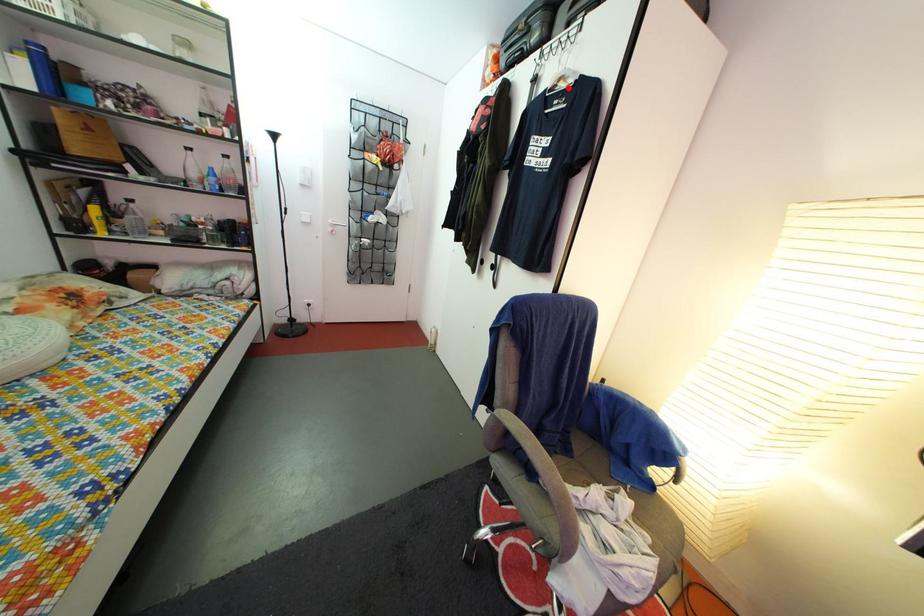
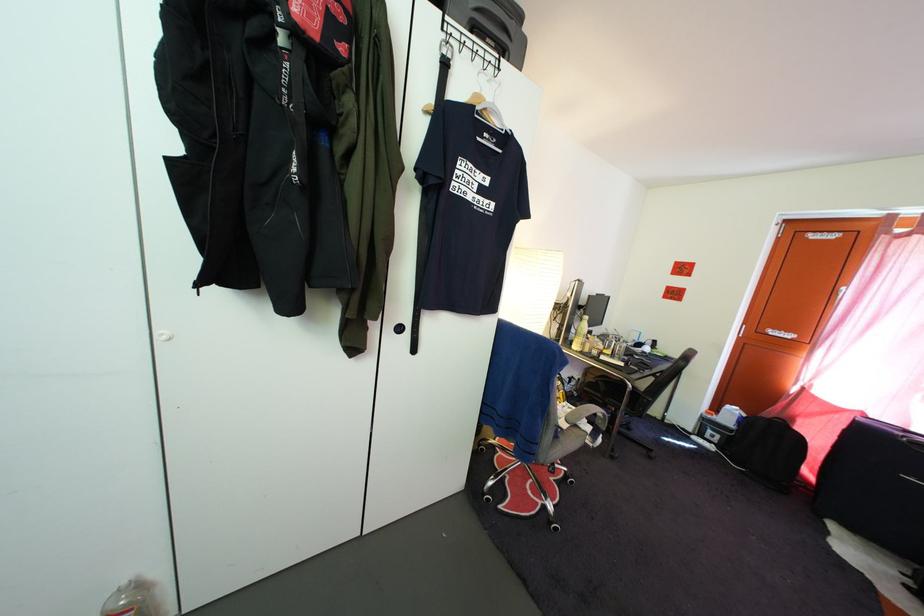
The point at the highlighted location is marked in the first image. Where is the corresponding point in the second image?

(494, 118)